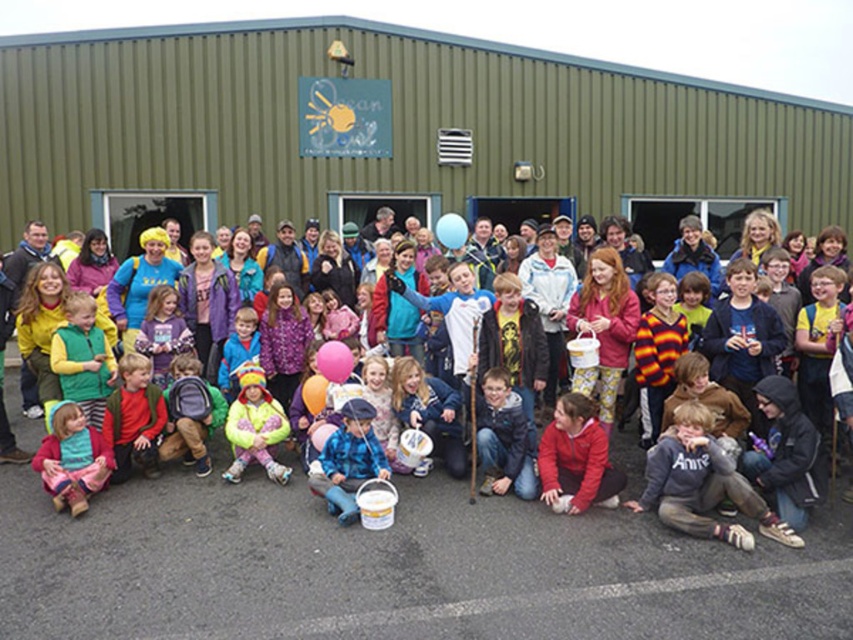
Consider the image. Can you confirm if matte yellow hat at center is shorter than light brown wooden stick at lower center?

Correct, matte yellow hat at center is not as tall as light brown wooden stick at lower center.

Is point (42, 536) closer to camera compared to point (503, 432)?

Yes.

Is point (624, 545) positioned before point (498, 490)?

Yes, it is.

This screenshot has width=853, height=640. I want to click on matte yellow hat at center, so click(x=366, y=545).

Does blue glossy balloon at center have a greater width compared to rubber pink balloon at center?

Indeed, blue glossy balloon at center has a greater width compared to rubber pink balloon at center.

Who is taller, blue glossy balloon at center or rubber pink balloon at center?

Standing taller between the two is rubber pink balloon at center.

Between point (454, 218) and point (311, 413), which one is positioned behind?

The point (454, 218) is behind.

Find the location of a particular element. This screenshot has width=853, height=640. blue glossy balloon at center is located at coordinates (451, 230).

Which is behind, point (230, 428) or point (349, 362)?

Point (349, 362)

Is point (283, 433) closer to viewer compared to point (316, 360)?

That is True.

Find the location of a particular element. fluorescent yellow jacket at center is located at coordinates (254, 426).